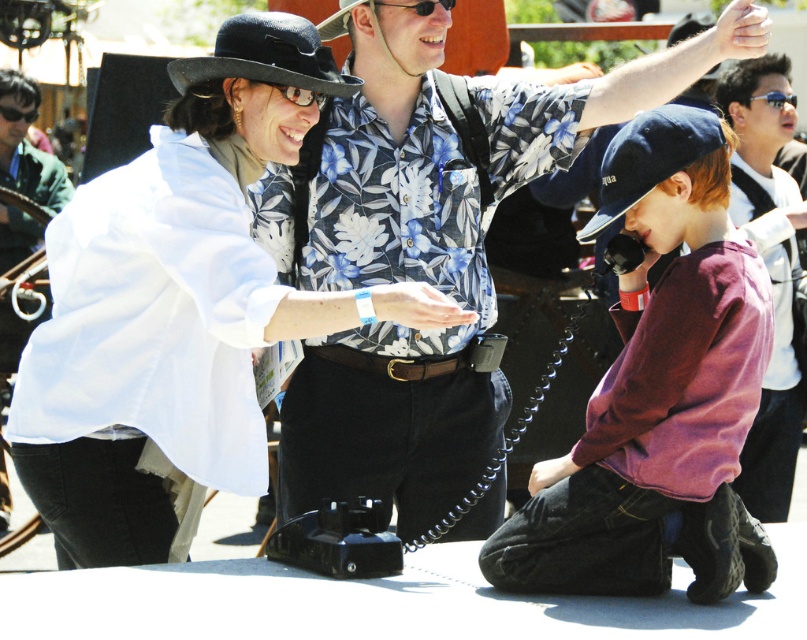
Question: Which of these objects is positioned farthest from the clear plastic goggles at center?

Choices:
 (A) white matte shirt at left
 (B) blue plastic goggles at upper right
 (C) dark blue fabric cap at lower center
 (D) floral shirt at center

Answer: (A)

Question: Does white matte shirt at upper left appear on the right side of blue plastic goggles at upper right?

Choices:
 (A) yes
 (B) no

Answer: (B)

Question: Which object is farther from the camera taking this photo?

Choices:
 (A) clear plastic goggles at center
 (B) white matte shirt at left

Answer: (B)

Question: Considering the relative positions of black plastic goggles at upper center and blue plastic goggles at upper right in the image provided, where is black plastic goggles at upper center located with respect to blue plastic goggles at upper right?

Choices:
 (A) below
 (B) above

Answer: (B)

Question: Is floral shirt at center bigger than black plastic goggles at upper center?

Choices:
 (A) no
 (B) yes

Answer: (A)

Question: Among these points, which one is nearest to the camera?

Choices:
 (A) (61, 168)
 (B) (300, 134)

Answer: (B)